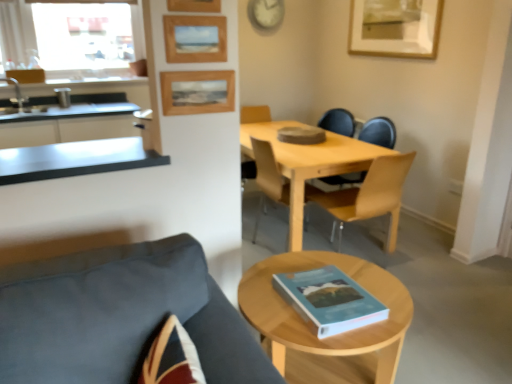
Find the location of `wooden picture frame at upper center, the third picture frame from the back`. wooden picture frame at upper center, the third picture frame from the back is located at coordinates (195, 38).

This screenshot has height=384, width=512. I want to click on white plastic clock at upper center, so click(266, 15).

Describe the element at coordinates (370, 196) in the screenshot. I see `light wood/wooden chair at center, the second chair in the front-to-back sequence` at that location.

Find the location of a particular element. wooden picture frame at upper center, the 2th picture frame positioned from the back is located at coordinates (197, 92).

Where is `satin steel countertop at left`? This screenshot has width=512, height=384. satin steel countertop at left is located at coordinates (68, 125).

You are a GUI agent. You are given a task and a screenshot of the screen. Output one action in this format:
    pyautogui.click(x=<x>, y=<y>)
    Task: Click on the clear glass window at upper left
    The height and width of the screenshot is (384, 512).
    Given the screenshot: What is the action you would take?
    pyautogui.click(x=17, y=30)

There is a light wood table at center. Identify the location of countertop above it (from a real-world perspective). (75, 159).

What's the angular difference between metallic gray countertop at left and light wood table at center's facing directions?

91.2 degrees separate the facing orientations of metallic gray countertop at left and light wood table at center.

Considering the relative positions of metallic gray countertop at left and light wood table at center in the image provided, is metallic gray countertop at left to the left of light wood table at center from the viewer's perspective?

Indeed, metallic gray countertop at left is positioned on the left side of light wood table at center.

Is metallic gray countertop at left facing away from light wood table at center?

That's not correct — metallic gray countertop at left is not looking away from light wood table at center.

Where is `kitchen & dining room table in front of the white plastic clock at upper center`? Image resolution: width=512 pixels, height=384 pixels. kitchen & dining room table in front of the white plastic clock at upper center is located at coordinates (309, 163).

From a real-world perspective, is light wood table at center located higher than white plastic clock at upper center?

No, from a real-world perspective, light wood table at center is not over white plastic clock at upper center

Measure the distance between light wood table at center and white plastic clock at upper center.

light wood table at center and white plastic clock at upper center are 5.54 feet apart from each other.

Is light wood table at center looking in the opposite direction of white plastic clock at upper center?

No, light wood table at center is not facing the opposite direction of white plastic clock at upper center.

Could you tell me if light wood table at center is turned towards wooden picture frame at upper center, acting as the second picture frame starting from the right?

No, light wood table at center is not facing towards wooden picture frame at upper center, acting as the second picture frame starting from the right.

Looking at this image, considering the relative sizes of light wood table at center and wooden picture frame at upper center, the 2th picture frame positioned from the back, in the image provided, is light wood table at center thinner than wooden picture frame at upper center, the 2th picture frame positioned from the back,?

Incorrect, the width of light wood table at center is not less than that of wooden picture frame at upper center, the 2th picture frame positioned from the back.

Visually, is light wood table at center positioned to the left or to the right of wooden picture frame at upper center, which ranks as the 3th picture frame in front-to-back order?

Based on their positions, light wood table at center is located to the right of wooden picture frame at upper center, which ranks as the 3th picture frame in front-to-back order.

From the image's perspective, which one is positioned higher, light wood table at center or wooden picture frame at upper center, acting as the second picture frame starting from the right?

From the image's view, wooden picture frame at upper center, acting as the second picture frame starting from the right, is above.

Is point (191, 6) positioned in front of point (369, 48)?

Yes, it is.

From the image's perspective, is wooden picture frame at upper center, which is the 1th picture frame in front-to-back order, below wooden picture frame at upper right, arranged as the fourth picture frame when ordered from the bottom?

Yes, from the image's perspective, wooden picture frame at upper center, which is the 1th picture frame in front-to-back order, is below wooden picture frame at upper right, arranged as the fourth picture frame when ordered from the bottom.

Between wooden picture frame at upper center, the second picture frame viewed from the top, and wooden picture frame at upper right, which is the first picture frame from right to left, which one has less height?

Standing shorter between the two is wooden picture frame at upper center, the second picture frame viewed from the top.

Is wooden picture frame at upper center, the second picture frame viewed from the top, directly adjacent to wooden picture frame at upper right, arranged as the fourth picture frame when ordered from the bottom?

No, wooden picture frame at upper center, the second picture frame viewed from the top, is not with wooden picture frame at upper right, arranged as the fourth picture frame when ordered from the bottom.

Can you tell me how much wooden picture frame at upper center, acting as the second picture frame starting from the right, and wooden picture frame at upper right, the first picture frame positioned from the back, differ in facing direction?

The angle between the facing direction of wooden picture frame at upper center, acting as the second picture frame starting from the right, and the facing direction of wooden picture frame at upper right, the first picture frame positioned from the back, is 90 degrees.

Is wooden picture frame at upper center, acting as the second picture frame starting from the right, positioned with its back to wooden picture frame at upper right, which ranks as the 4th picture frame in left-to-right order?

No, wooden picture frame at upper center, acting as the second picture frame starting from the right,'s orientation is not away from wooden picture frame at upper right, which ranks as the 4th picture frame in left-to-right order.

Measure the distance between wooden picture frame at upper center, which is the 1th picture frame in bottom-to-top order, and wooden picture frame at upper right, arranged as the 4th picture frame when viewed from the front.

wooden picture frame at upper center, which is the 1th picture frame in bottom-to-top order, and wooden picture frame at upper right, arranged as the 4th picture frame when viewed from the front, are 2.31 meters apart from each other.

Which is more to the left, wooden picture frame at upper center, which is the 1th picture frame in bottom-to-top order, or wooden picture frame at upper right, the first picture frame positioned from the back?

wooden picture frame at upper center, which is the 1th picture frame in bottom-to-top order.

Is light wood table at center with blue matte book at lower center?

No, light wood table at center is not making contact with blue matte book at lower center.

Who is taller, light wood table at center or blue matte book at lower center?

With more height is light wood table at center.

Which is behind, point (298, 149) or point (361, 308)?

Point (298, 149)

From the picture: From a real-world perspective, is light wood table at center positioned under blue matte book at lower center based on gravity?

Yes.

Between light wood coffee table at center and white plastic clock at upper center, which one appears on the right side from the viewer's perspective?

From the viewer's perspective, light wood coffee table at center appears more on the right side.

From the image's perspective, is light wood coffee table at center located beneath white plastic clock at upper center?

Yes, from the image's perspective, light wood coffee table at center is beneath white plastic clock at upper center.

Which is more distant, (377, 295) or (259, 9)?

Point (259, 9)

Find the location of a particular element. clock behind the light wood coffee table at center is located at coordinates (266, 15).

At what (x,y) coordinates should I click in order to perform the action: click on kitchen & dining room table that is on the right side of metallic gray countertop at left. Please return your answer as a coordinate pair (x, y). This screenshot has height=384, width=512. Looking at the image, I should click on pyautogui.click(x=309, y=163).

Identify the location of kitchen & dining room table that appears in front of the white plastic clock at upper center. (309, 163).

Based on their spatial positions, is clear glass window at upper left or satin steel countertop at left closer to wooden picture frame at upper center, the first picture frame viewed from the left?

satin steel countertop at left lies closer to wooden picture frame at upper center, the first picture frame viewed from the left, than the other object.

Estimate the real-world distances between objects in this image. Which object is closer to wooden picture frame at upper center, which appears as the 3th picture frame when viewed from the top, wooden picture frame at upper center, which is the 1th picture frame in front-to-back order, or dark gray fabric chair at lower left, acting as the first chair starting from the front?

Among the two, wooden picture frame at upper center, which is the 1th picture frame in front-to-back order, is located nearer to wooden picture frame at upper center, which appears as the 3th picture frame when viewed from the top.

Based on their spatial positions, is satin steel countertop at left or wooden picture frame at upper center, positioned as the 2th picture frame in front-to-back order, further from white plastic clock at upper center?

The object further to white plastic clock at upper center is wooden picture frame at upper center, positioned as the 2th picture frame in front-to-back order.

Looking at this image, looking at the image, which one is located closer to metallic gray countertop at left, wooden chair at center, which appears as the 1th chair when viewed from the back, or white plastic clock at upper center?

wooden chair at center, which appears as the 1th chair when viewed from the back, is positioned closer to the anchor metallic gray countertop at left.

Which object lies further to the anchor point wooden chair at center, which is counted as the 3th chair, starting from the front, dark gray fabric chair at lower left, acting as the first chair starting from the front, or wooden picture frame at upper right, arranged as the 4th picture frame when viewed from the front?

Among the two, wooden picture frame at upper right, arranged as the 4th picture frame when viewed from the front, is located further to wooden chair at center, which is counted as the 3th chair, starting from the front.

Looking at the image, which one is located further to wooden picture frame at upper right, the first picture frame positioned from the back, clear glass window at upper left or light wood table at center?

clear glass window at upper left is further to wooden picture frame at upper right, the first picture frame positioned from the back.

Based on their spatial positions, is wooden picture frame at upper center, the second picture frame viewed from the top, or white plastic clock at upper center closer to wooden picture frame at upper right, which ranks as the 4th picture frame in left-to-right order?

The object closer to wooden picture frame at upper right, which ranks as the 4th picture frame in left-to-right order, is white plastic clock at upper center.

From the image, which object appears to be nearer to wooden picture frame at upper center, acting as the second picture frame starting from the right, light wood table at center or clear glass window at upper left?

Among the two, light wood table at center is located nearer to wooden picture frame at upper center, acting as the second picture frame starting from the right.

The image size is (512, 384). What are the coordinates of `book between satin steel countertop at left and wooden chair at center, which appears as the 1th chair when viewed from the back, in the horizontal direction` in the screenshot? It's located at (329, 300).

You are a GUI agent. You are given a task and a screenshot of the screen. Output one action in this format:
    pyautogui.click(x=<x>, y=<y>)
    Task: Click on the window positioned between blue matte book at lower center and white plastic clock at upper center from near to far
    This screenshot has width=512, height=384.
    Given the screenshot: What is the action you would take?
    pyautogui.click(x=17, y=30)

Image resolution: width=512 pixels, height=384 pixels. I want to click on chair positioned between light wood coffee table at center and wooden chair at center, which is counted as the 3th chair, starting from the front, from near to far, so click(370, 196).

Locate an element on the screen. Image resolution: width=512 pixels, height=384 pixels. cabinetry between clear glass window at upper left and light wood table at center in the horizontal direction is located at coordinates (68, 125).